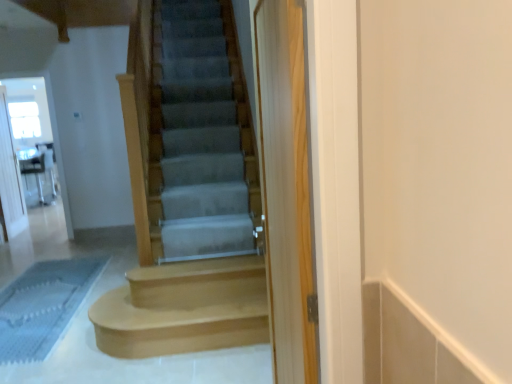
Question: Should I look upward or downward to see light brown wood stairs at center, which is the second stairs from front to back?

Choices:
 (A) up
 (B) down

Answer: (B)

Question: From the image's perspective, does blue textured bath mat at lower left appear lower than light brown wood stairs at center, which is the second stairs from front to back?

Choices:
 (A) no
 (B) yes

Answer: (B)

Question: Does blue textured bath mat at lower left have a lesser width compared to light brown wood stairs at center, which appears as the first stairs when viewed from the back?

Choices:
 (A) no
 (B) yes

Answer: (A)

Question: Is the position of blue textured bath mat at lower left less distant than that of light brown wood stairs at center, which is counted as the second stairs, starting from the top?

Choices:
 (A) no
 (B) yes

Answer: (A)

Question: Is blue textured bath mat at lower left surrounding light brown wood stairs at center, which appears as the first stairs when viewed from the back?

Choices:
 (A) yes
 (B) no

Answer: (B)

Question: Can you confirm if blue textured bath mat at lower left is wider than light brown wood stairs at center, the first stairs when ordered from bottom to top?

Choices:
 (A) no
 (B) yes

Answer: (B)

Question: From a real-world perspective, does blue textured bath mat at lower left stand above light brown wood stairs at center, which is counted as the second stairs, starting from the top?

Choices:
 (A) no
 (B) yes

Answer: (A)

Question: Would you say clear wood screen door at center, arranged as the third screen door when viewed from the back, is part of blue textured bath mat at lower left's contents?

Choices:
 (A) no
 (B) yes

Answer: (A)

Question: Is blue textured bath mat at lower left not within clear wood screen door at center, which is the first screen door from right to left?

Choices:
 (A) yes
 (B) no

Answer: (A)

Question: Does blue textured bath mat at lower left have a greater width compared to clear wood screen door at center, which is the 3th screen door from left to right?

Choices:
 (A) no
 (B) yes

Answer: (B)

Question: Does blue textured bath mat at lower left have a greater height compared to clear wood screen door at center, positioned as the 1th screen door in front-to-back order?

Choices:
 (A) yes
 (B) no

Answer: (B)

Question: Does blue textured bath mat at lower left touch clear wood screen door at center, which is the first screen door from right to left?

Choices:
 (A) no
 (B) yes

Answer: (A)

Question: Could you tell me if blue textured bath mat at lower left is turned towards clear wood screen door at center, positioned as the 1th screen door in front-to-back order?

Choices:
 (A) yes
 (B) no

Answer: (B)

Question: Is clear glass screen door at upper left, acting as the second screen door starting from the right, surrounded by light brown wood stairs at center, which is counted as the second stairs, starting from the top?

Choices:
 (A) no
 (B) yes

Answer: (A)